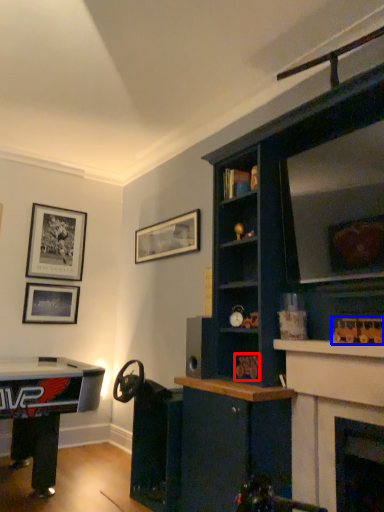
Question: Which point is further to the camera, toy (highlighted by a red box) or toy (highlighted by a blue box)?

Choices:
 (A) toy
 (B) toy

Answer: (A)